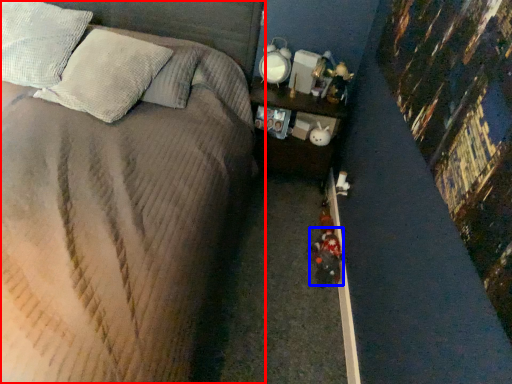
Question: Among these objects, which one is nearest to the camera, bed (highlighted by a red box) or toy (highlighted by a blue box)?

Choices:
 (A) bed
 (B) toy

Answer: (A)